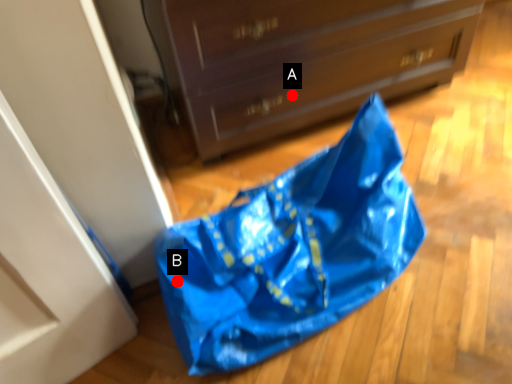
Question: Two points are circled on the image, labeled by A and B beside each circle. Which point is closer to the camera?

Choices:
 (A) A is closer
 (B) B is closer

Answer: (B)